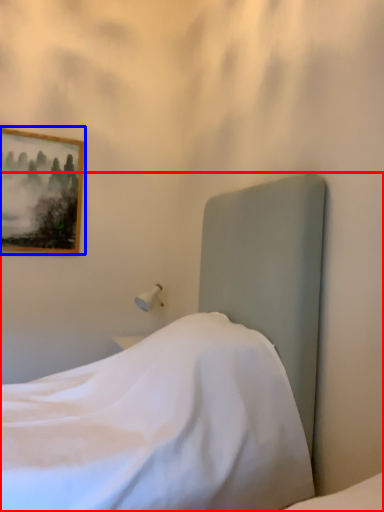
Question: Which object is closer to the camera taking this photo, bed (highlighted by a red box) or picture frame (highlighted by a blue box)?

Choices:
 (A) bed
 (B) picture frame

Answer: (A)